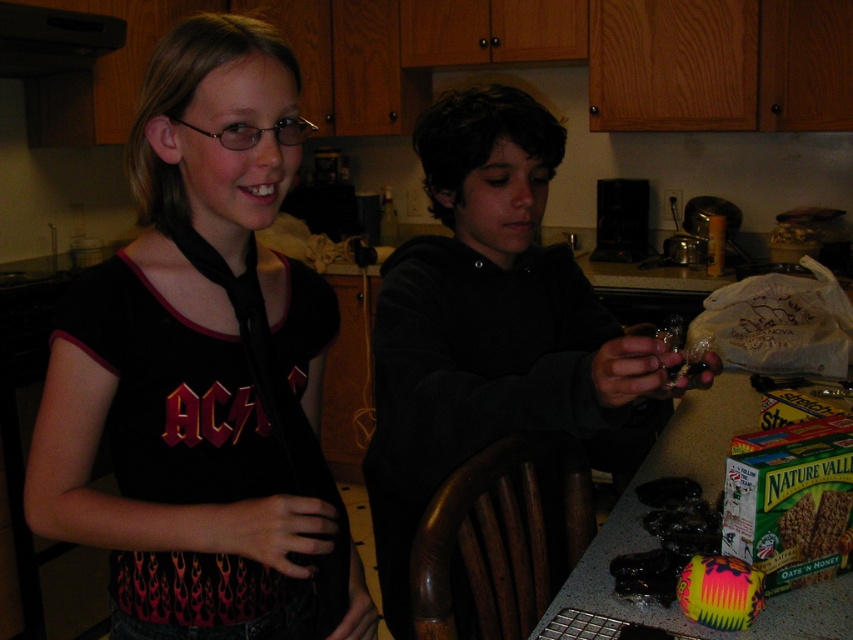
Where is `black matte tie at center`? This screenshot has width=853, height=640. black matte tie at center is located at coordinates (202, 368).

Can you confirm if black matte tie at center is taller than dark gray hoodie at center?

Incorrect, black matte tie at center's height is not larger of dark gray hoodie at center's.

Find the location of a particular element. The image size is (853, 640). black matte tie at center is located at coordinates (202, 368).

The image size is (853, 640). I want to click on black matte tie at center, so click(x=202, y=368).

Measure the distance from dark gray hoodie at center to multicolored fabric bag at lower right.

dark gray hoodie at center and multicolored fabric bag at lower right are 17.30 inches apart from each other.

Which is more to the right, dark gray hoodie at center or multicolored fabric bag at lower right?

Positioned to the right is multicolored fabric bag at lower right.

Does point (408, 385) lie behind point (747, 618)?

Yes, point (408, 385) is farther from viewer.

I want to click on dark gray hoodie at center, so click(492, 328).

Can you confirm if black matte tie at center is positioned above multicolored fabric bag at lower right?

Correct, black matte tie at center is located above multicolored fabric bag at lower right.

Is point (210, 492) positioned after point (738, 589)?

Yes, point (210, 492) is farther from viewer.

This screenshot has width=853, height=640. I want to click on black matte tie at center, so click(x=202, y=368).